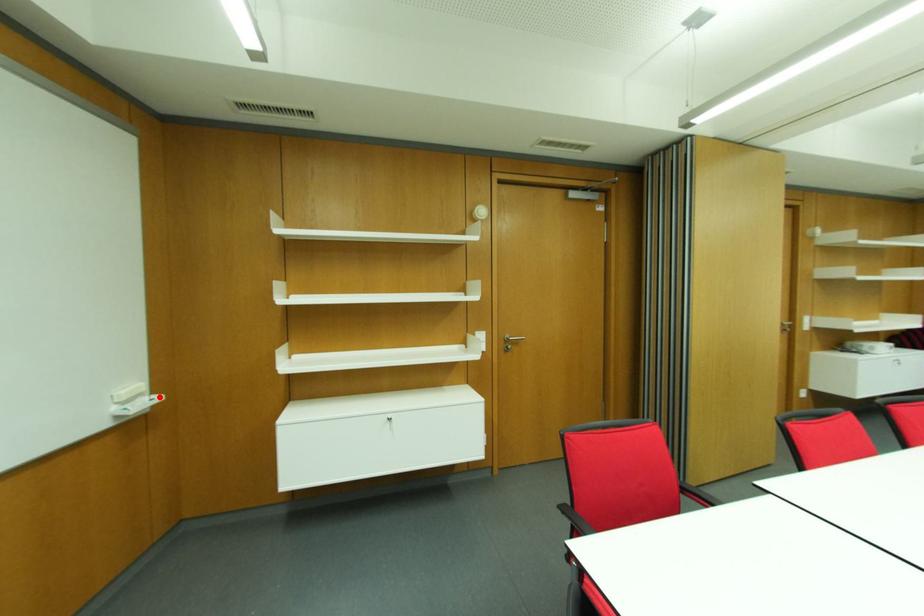
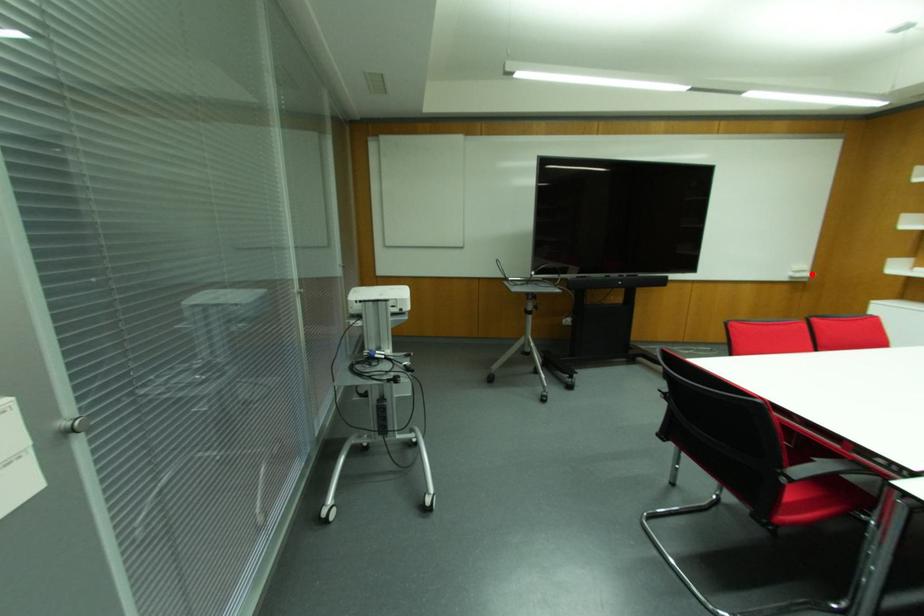
I am providing you with two images of the same scene from different viewpoints. A red point is marked on the first image and another point is marked on the second image. Are the points marked in image1 and image2 representing the same 3D position?

Yes